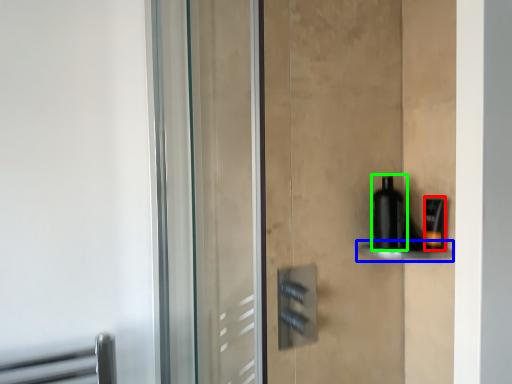
Question: Considering the real-world distances, which object is farthest from toiletry (highlighted by a red box)? shelf (highlighted by a blue box) or bottle (highlighted by a green box)?

Choices:
 (A) shelf
 (B) bottle

Answer: (B)